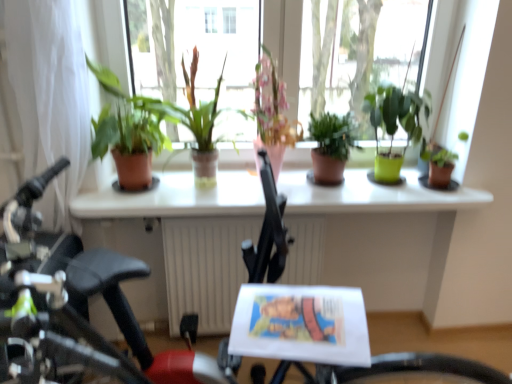
Describe the element at coordinates (330, 147) in the screenshot. The image size is (512, 384). I see `green matte plant at center, arranged as the third houseplant when viewed from the right` at that location.

You are a GUI agent. You are given a task and a screenshot of the screen. Output one action in this format:
    pyautogui.click(x=<x>, y=<y>)
    Task: Click on the green matte plant at center, arranged as the third houseplant when viewed from the right
    
    Given the screenshot: What is the action you would take?
    pyautogui.click(x=330, y=147)

What do you see at coordinates (439, 168) in the screenshot? This screenshot has width=512, height=384. I see `green matte plant at right, positioned as the 1th houseplant in right-to-left order` at bounding box center [439, 168].

How much space does matte terracotta pot at left, positioned as the 6th houseplant in right-to-left order, occupy vertically?

It is 20.47 inches.

Locate an element on the screen. terracotta pot at center, acting as the 2th houseplant starting from the left is located at coordinates (198, 124).

What do you see at coordinates (198, 124) in the screenshot? I see `terracotta pot at center, acting as the 2th houseplant starting from the left` at bounding box center [198, 124].

The image size is (512, 384). In order to click on white sheer curtain at left in this screenshot , I will do `click(50, 98)`.

From a real-world perspective, is pink ceramic vase at center, positioned as the 4th houseplant in right-to-left order, physically above green matte plant at right, positioned as the 1th houseplant in right-to-left order?

Yes, from a real-world perspective, pink ceramic vase at center, positioned as the 4th houseplant in right-to-left order, is on top of green matte plant at right, positioned as the 1th houseplant in right-to-left order.

Is pink ceramic vase at center, positioned as the 4th houseplant in right-to-left order, bigger than green matte plant at right, which is the 6th houseplant in left-to-right order?

Yes, pink ceramic vase at center, positioned as the 4th houseplant in right-to-left order, is bigger than green matte plant at right, which is the 6th houseplant in left-to-right order.

Is pink ceramic vase at center, positioned as the 4th houseplant in right-to-left order, positioned with its back to green matte plant at right, which is the 6th houseplant in left-to-right order?

That's not correct — pink ceramic vase at center, positioned as the 4th houseplant in right-to-left order, is not looking away from green matte plant at right, which is the 6th houseplant in left-to-right order.

Choose the correct answer: Is pink ceramic vase at center, positioned as the 4th houseplant in right-to-left order, inside green matte plant at right, positioned as the 1th houseplant in right-to-left order, or outside it?

pink ceramic vase at center, positioned as the 4th houseplant in right-to-left order, is outside green matte plant at right, positioned as the 1th houseplant in right-to-left order.

Does white glossy table at center come in front of terracotta pot at center, acting as the 2th houseplant starting from the left?

Yes, it is in front of terracotta pot at center, acting as the 2th houseplant starting from the left.

Based on the photo, which is more to the left, white glossy table at center or terracotta pot at center, acting as the 2th houseplant starting from the left?

terracotta pot at center, acting as the 2th houseplant starting from the left, is more to the left.

Is white glossy table at center in contact with terracotta pot at center, acting as the 2th houseplant starting from the left?

No, white glossy table at center is not making contact with terracotta pot at center, acting as the 2th houseplant starting from the left.

Is white glossy table at center taller than terracotta pot at center, which ranks as the 5th houseplant in right-to-left order?

Indeed, white glossy table at center has a greater height compared to terracotta pot at center, which ranks as the 5th houseplant in right-to-left order.

Can you tell me how much white glossy table at center and green matte plant at center, which ranks as the fifth houseplant in left-to-right order, differ in facing direction?

92.8 degrees.

Is white glossy table at center looking in the opposite direction of green matte plant at center, which ranks as the fifth houseplant in left-to-right order?

No, white glossy table at center is not facing away from green matte plant at center, which ranks as the fifth houseplant in left-to-right order.

Is point (122, 211) closer or farther from the camera than point (370, 102)?

Point (122, 211) is positioned closer to the camera compared to point (370, 102).

Is white glossy table at center in front of or behind green matte plant at center, which appears as the second houseplant when viewed from the right, in the image?

Clearly, white glossy table at center is in front of green matte plant at center, which appears as the second houseplant when viewed from the right.

Based on the photo, what's the angular difference between green matte plant at center, which appears as the second houseplant when viewed from the right, and green matte plant at center, which appears as the 4th houseplant when viewed from the left,'s facing directions?

green matte plant at center, which appears as the second houseplant when viewed from the right, and green matte plant at center, which appears as the 4th houseplant when viewed from the left, are facing 0.00239 degrees away from each other.

In the image, is green matte plant at center, which appears as the second houseplant when viewed from the right, on the left side or the right side of green matte plant at center, which appears as the 4th houseplant when viewed from the left?

Clearly, green matte plant at center, which appears as the second houseplant when viewed from the right, is on the right of green matte plant at center, which appears as the 4th houseplant when viewed from the left, in the image.

From the image's perspective, relative to green matte plant at center, which appears as the 4th houseplant when viewed from the left, is green matte plant at center, which appears as the second houseplant when viewed from the right, above or below?

green matte plant at center, which appears as the second houseplant when viewed from the right, is situated higher than green matte plant at center, which appears as the 4th houseplant when viewed from the left, in the image.

Which of these two, green matte plant at center, which appears as the second houseplant when viewed from the right, or green matte plant at center, which appears as the 4th houseplant when viewed from the left, stands shorter?

With less height is green matte plant at center, which appears as the 4th houseplant when viewed from the left.

Considering the relative sizes of white glossy table at center and green matte plant at right, positioned as the 1th houseplant in right-to-left order, in the image provided, is white glossy table at center taller than green matte plant at right, positioned as the 1th houseplant in right-to-left order,?

Yes, white glossy table at center is taller than green matte plant at right, positioned as the 1th houseplant in right-to-left order.

From a real-world perspective, which object stands above the other?

From a 3D spatial view, green matte plant at right, positioned as the 1th houseplant in right-to-left order, is above.

Is green matte plant at right, positioned as the 1th houseplant in right-to-left order, at the back of white glossy table at center?

No, white glossy table at center's orientation is not away from green matte plant at right, positioned as the 1th houseplant in right-to-left order.

Does white sheer curtain at left lie in front of green matte plant at center, arranged as the third houseplant when viewed from the right?

Yes.

At what (x,y) coordinates should I click in order to perform the action: click on the 1st houseplant below the white sheer curtain at left (from the image's perspective). Please return your answer as a coordinate pair (x, y). This screenshot has width=512, height=384. Looking at the image, I should click on (330, 147).

From a real-world perspective, is white sheer curtain at left on green matte plant at center, arranged as the third houseplant when viewed from the right?

Yes.

Which of these two, matte terracotta pot at left, positioned as the 6th houseplant in right-to-left order, or green matte plant at center, which appears as the second houseplant when viewed from the right, stands taller?

matte terracotta pot at left, positioned as the 6th houseplant in right-to-left order, is taller.

From a real-world perspective, does matte terracotta pot at left, positioned as the 6th houseplant in right-to-left order, sit lower than green matte plant at center, which appears as the second houseplant when viewed from the right?

No.

Is matte terracotta pot at left, which appears as the first houseplant when viewed from the left, far away from green matte plant at center, which appears as the second houseplant when viewed from the right?

That's not correct — matte terracotta pot at left, which appears as the first houseplant when viewed from the left, is a little close to green matte plant at center, which appears as the second houseplant when viewed from the right.

Is matte terracotta pot at left, which appears as the first houseplant when viewed from the left, not inside green matte plant at center, which ranks as the fifth houseplant in left-to-right order?

matte terracotta pot at left, which appears as the first houseplant when viewed from the left, lies outside green matte plant at center, which ranks as the fifth houseplant in left-to-right order,'s area.

Which houseplant is the 3rd one when counting from the left side of the green matte plant at right, which is the 6th houseplant in left-to-right order? Please provide its 2D coordinates.

[(272, 114)]

Image resolution: width=512 pixels, height=384 pixels. I want to click on table that appears on the right of terracotta pot at center, which ranks as the 5th houseplant in right-to-left order, so click(x=175, y=198).

Which object lies nearer to the anchor point green matte plant at center, which ranks as the fifth houseplant in left-to-right order, green matte plant at center, which appears as the 4th houseplant when viewed from the left, or green matte plant at right, positioned as the 1th houseplant in right-to-left order?

Among the two, green matte plant at center, which appears as the 4th houseplant when viewed from the left, is located nearer to green matte plant at center, which ranks as the fifth houseplant in left-to-right order.

Considering their positions, is green matte plant at right, positioned as the 1th houseplant in right-to-left order, positioned further to white glossy table at center than green matte plant at center, which appears as the second houseplant when viewed from the right?

Based on the image, green matte plant at right, positioned as the 1th houseplant in right-to-left order, appears to be further to white glossy table at center.

When comparing their distances from white sheer curtain at left, does green matte plant at right, which is the 6th houseplant in left-to-right order, or terracotta pot at center, acting as the 2th houseplant starting from the left, seem further?

green matte plant at right, which is the 6th houseplant in left-to-right order, is positioned further to the anchor white sheer curtain at left.

Which object lies further to the anchor point white glossy table at center, green matte plant at center, which appears as the second houseplant when viewed from the right, or green matte plant at right, which is the 6th houseplant in left-to-right order?

Based on the image, green matte plant at right, which is the 6th houseplant in left-to-right order, appears to be further to white glossy table at center.

Considering their positions, is green matte plant at center, which ranks as the fifth houseplant in left-to-right order, positioned closer to white glossy window sill at center than white glossy table at center?

white glossy table at center lies closer to white glossy window sill at center than the other object.

Looking at the image, which one is located closer to green matte plant at right, which is the 6th houseplant in left-to-right order, white glossy table at center or matte terracotta pot at left, positioned as the 6th houseplant in right-to-left order?

The object closer to green matte plant at right, which is the 6th houseplant in left-to-right order, is white glossy table at center.

Which object lies nearer to the anchor point terracotta pot at center, acting as the 2th houseplant starting from the left, green matte plant at center, which appears as the 4th houseplant when viewed from the left, or green matte plant at right, which is the 6th houseplant in left-to-right order?

green matte plant at center, which appears as the 4th houseplant when viewed from the left, is positioned closer to the anchor terracotta pot at center, acting as the 2th houseplant starting from the left.

Estimate the real-world distances between objects in this image. Which object is further from terracotta pot at center, which ranks as the 5th houseplant in right-to-left order, white sheer curtain at left or pink ceramic vase at center, the 3th houseplant when ordered from left to right?

white sheer curtain at left lies further to terracotta pot at center, which ranks as the 5th houseplant in right-to-left order, than the other object.

Find the location of a particular element. Image resolution: width=512 pixels, height=384 pixels. window sill situated between white sheer curtain at left and green matte plant at center, which ranks as the fifth houseplant in left-to-right order, from left to right is located at coordinates (176, 198).

Locate an element on the screen. window sill between matte terracotta pot at left, positioned as the 6th houseplant in right-to-left order, and green matte plant at right, positioned as the 1th houseplant in right-to-left order, from left to right is located at coordinates (176, 198).

Identify the location of window sill positioned between white glossy table at center and green matte plant at center, which appears as the 4th houseplant when viewed from the left, from near to far. (176, 198).

Where is `window sill between terracotta pot at center, which ranks as the 5th houseplant in right-to-left order, and green matte plant at center, which appears as the second houseplant when viewed from the right`? window sill between terracotta pot at center, which ranks as the 5th houseplant in right-to-left order, and green matte plant at center, which appears as the second houseplant when viewed from the right is located at coordinates (176, 198).